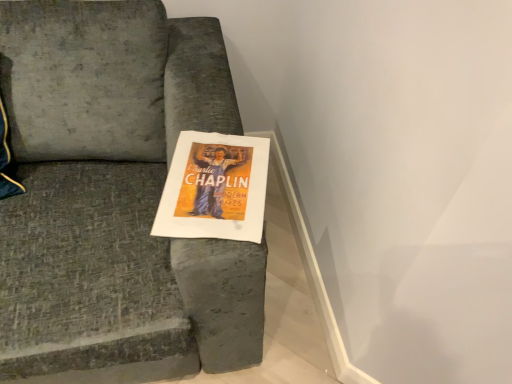
Question: Is matte paper poster at center wider or thinner than velvet gray couch at center?

Choices:
 (A) wide
 (B) thin

Answer: (B)

Question: Is matte paper poster at center to the left or to the right of velvet gray couch at center in the image?

Choices:
 (A) left
 (B) right

Answer: (B)

Question: Is matte paper poster at center spatially inside velvet gray couch at center, or outside of it?

Choices:
 (A) inside
 (B) outside

Answer: (A)

Question: Do you think velvet gray couch at center is within matte paper poster at center, or outside of it?

Choices:
 (A) inside
 (B) outside

Answer: (B)

Question: From a real-world perspective, is velvet gray couch at center positioned above or below matte paper poster at center?

Choices:
 (A) below
 (B) above

Answer: (A)

Question: Considering the positions of velvet gray couch at center and matte paper poster at center in the image, is velvet gray couch at center bigger or smaller than matte paper poster at center?

Choices:
 (A) small
 (B) big

Answer: (B)

Question: Considering their positions, is velvet gray couch at center located in front of or behind matte paper poster at center?

Choices:
 (A) front
 (B) behind

Answer: (A)